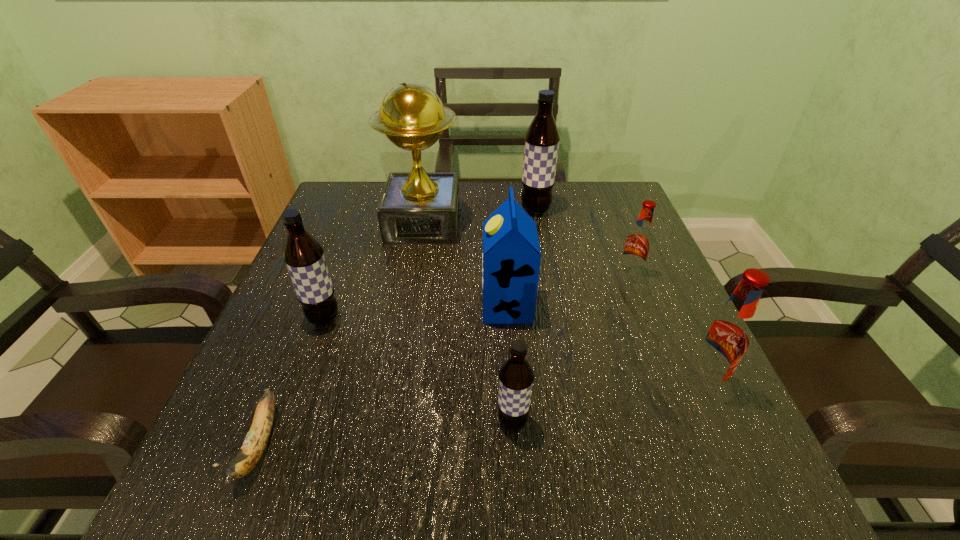
You are a GUI agent. You are given a task and a screenshot of the screen. Output one action in this format:
    pyautogui.click(x=<x>, y=<y>)
    Task: Click on the free space at the right edge of the desktop
    The height and width of the screenshot is (540, 960).
    Given the screenshot: What is the action you would take?
    pyautogui.click(x=631, y=315)

Locate an element on the screen. vacant space at the near left corner is located at coordinates (271, 506).

The image size is (960, 540). I want to click on free location at the far right corner of the desktop, so click(x=621, y=224).

I want to click on vacant area at the near right corner of the desktop, so click(696, 450).

You are a GUI agent. You are given a task and a screenshot of the screen. Output one action in this format:
    pyautogui.click(x=<x>, y=<y>)
    Task: Click on the free space between the third farthest object and the nearest root beer
    
    Given the screenshot: What is the action you would take?
    pyautogui.click(x=571, y=348)

Where is `blank region between the carton and the third nearest root beer`? Image resolution: width=960 pixels, height=540 pixels. blank region between the carton and the third nearest root beer is located at coordinates (416, 312).

I want to click on vacant area between the smaller red root beer and the shortest object, so click(445, 359).

The width and height of the screenshot is (960, 540). What are the coordinates of `vacant area that lies between the banana and the rightmost brown root beer` in the screenshot? It's located at (398, 327).

Identify the location of free spot between the sixth object from right to left and the blue carton. (465, 265).

The width and height of the screenshot is (960, 540). I want to click on vacant point located between the second brown root beer from left to right and the second biggest brown root beer, so click(419, 370).